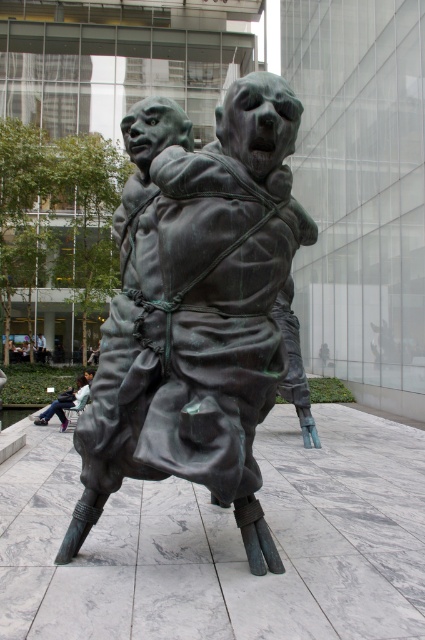
You are an art student who wants to sketch the sculpture in the plaza. You have a small sketchbook that can only fit items up to the size of the matte black jacket at lower left. Can you fit the green patina bronze statue at center in your sketchbook?

The green patina bronze statue at center is larger than the matte black jacket at lower left. Since your sketchbook can only accommodate items up to the size of the matte black jacket at lower left, you won